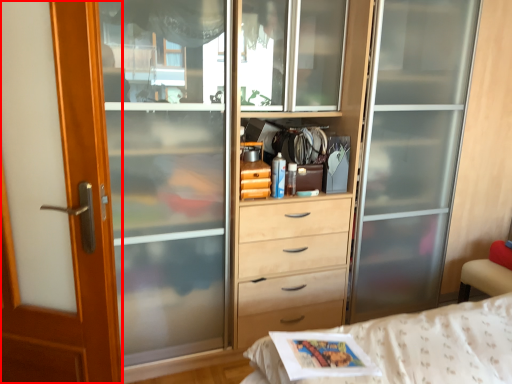
Question: From the image's perspective, where is screen door (annotated by the red box) located in relation to magazine in the image?

Choices:
 (A) below
 (B) above

Answer: (A)